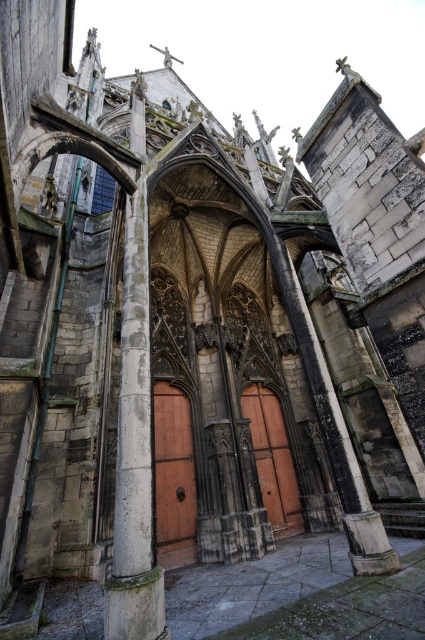
You are standing in front of the Gothic church and notice two points marked on the facade. The first point is at coordinates point (136, 433) and the second is at point (269, 460). Which of these two points is physically closer to your current position?

Point (136, 433) is closer to the viewer than point (269, 460).

You are standing in front of the Gothic church and want to enter through the main entrance. The stone column at center is blocking your path to the brown wooden door at center. Can you walk around it to access the door?

The stone column at center is positioned over brown wooden door at center, meaning the column is above the door, so you can walk through the space under the column to reach the brown wooden door at center.